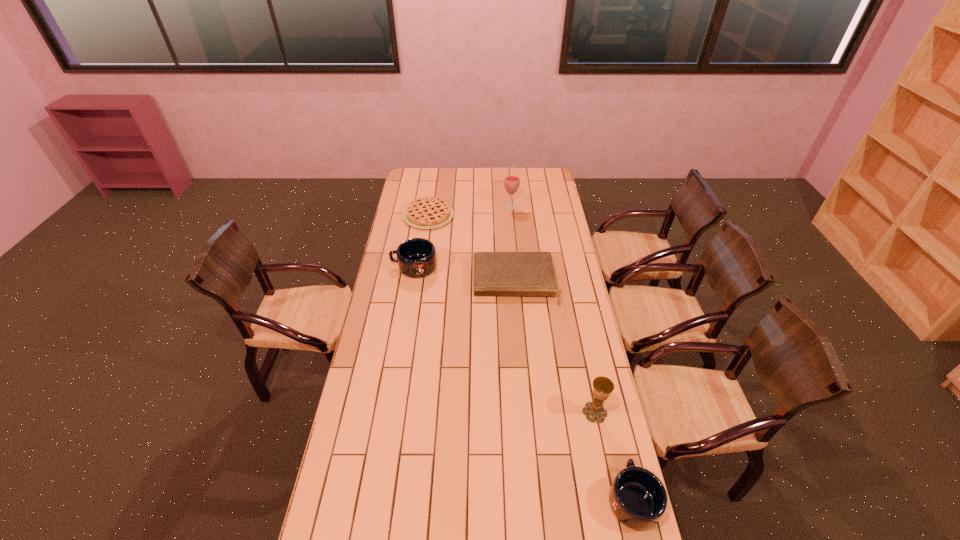
Find the location of a particular element. chalice positioned at the right edge is located at coordinates coord(602,386).

In order to click on object that is at the near right corner in this screenshot , I will do `click(637, 497)`.

Locate an element on the screen. The width and height of the screenshot is (960, 540). free space at the far edge of the desktop is located at coordinates (445, 178).

In the image, there is a desktop. Where is `vacant space at the left edge`? vacant space at the left edge is located at coordinates (389, 279).

In the image, there is a desktop. Identify the location of vacant space at the right edge. (546, 194).

Locate an element on the screen. empty location between the taller mug and the second nearest object is located at coordinates (504, 340).

You are a GUI agent. You are given a task and a screenshot of the screen. Output one action in this format:
    pyautogui.click(x=<x>, y=<y>)
    Task: Click on the free space between the fifth farthest object and the paperback book
    
    Given the screenshot: What is the action you would take?
    pyautogui.click(x=555, y=348)

Locate an element on the screen. This screenshot has width=960, height=540. free space between the left mug and the nearer mug is located at coordinates (523, 382).

At what (x,y) coordinates should I click in order to perform the action: click on free spot between the nearer mug and the pie. Please return your answer as a coordinate pair (x, y). Looking at the image, I should click on (531, 357).

In order to click on free area in between the second nearest object and the left mug in this screenshot , I will do `click(504, 340)`.